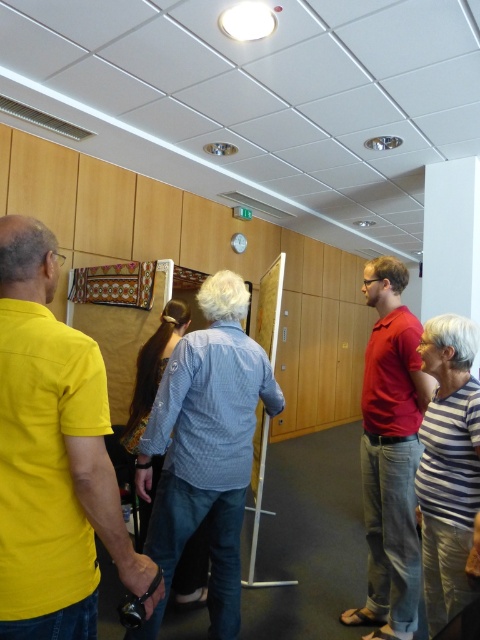
You are standing in the gallery and want to take a photo of the point at coordinates [219,401]. Your camera has a maximum focus range of 6 feet. Can you focus on the point without moving closer?

The point at coordinates [219,401] is 6.49 feet away from the viewer. Since the camera can only focus up to 6 feet, it cannot focus on the point without moving closer.

You are standing in the gallery and want to take a photo of the exhibit. The camera you have is 0.5 meters wide. There is a path between the denim shirt at center and the man in yellow polo shirt on the left. Can you fit through the path with your camera?

The path between the denim shirt at center and the man in yellow polo shirt on the left is not described in terms of width, so it is impossible to determine if the camera can fit through the path.

You are an event planner trying to arrange seating for a presentation in this gallery. You need to place chairs in front of the display where the yellow matte shirt at left and matte red shirt at center are standing. Which person requires a wider chair based on their current attire?

The yellow matte shirt at left requires a wider chair because its width surpasses that of the matte red shirt at center.